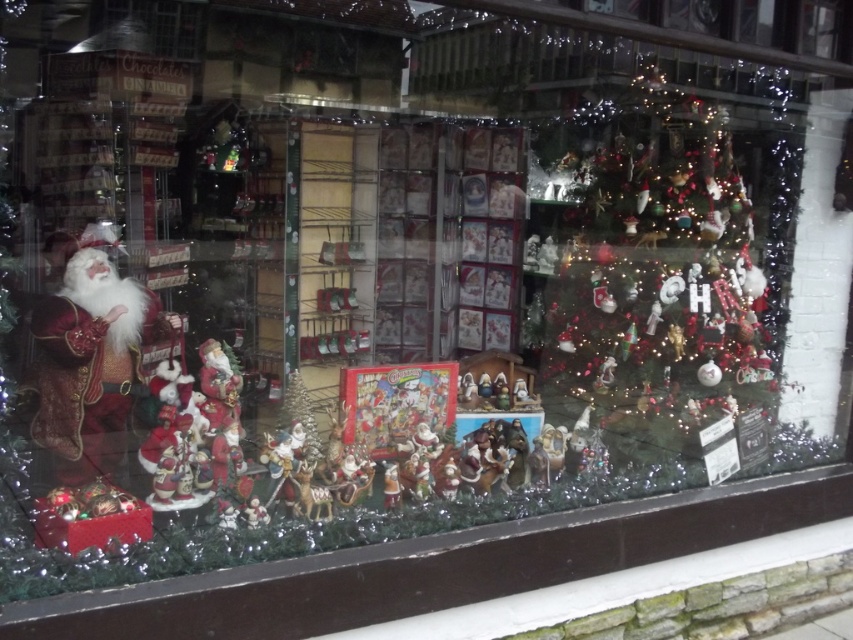
You are a shop assistant who needs to reach the iridescent glass ornaments at upper right and the velvet red santa claus at left. Which object is taller?

The iridescent glass ornaments at upper right is taller than the velvet red santa claus at left.

Where are the iridescent glass ornaments at upper right located in the Christmas display?

The iridescent glass ornaments at upper right are located at point (664, 262) in the Christmas display.